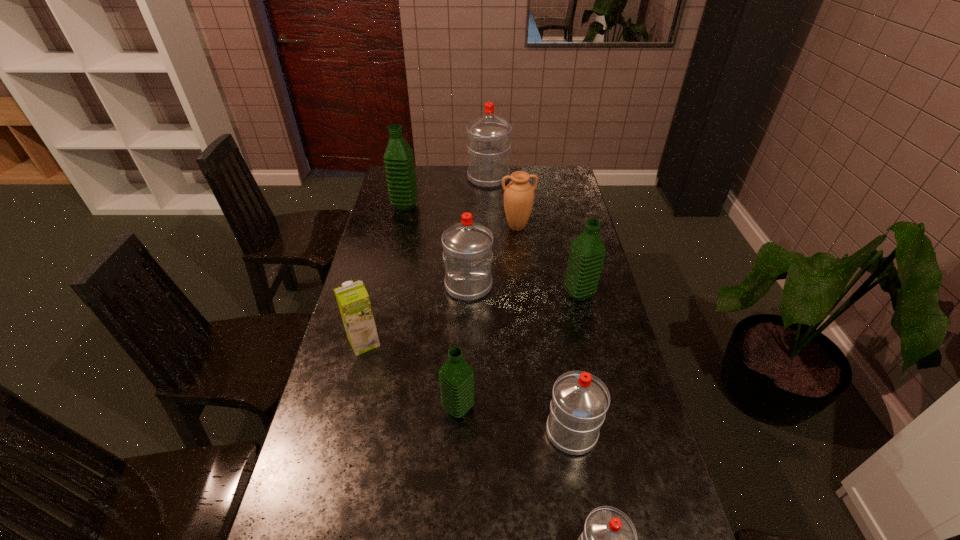
You are a GUI agent. You are given a task and a screenshot of the screen. Output one action in this format:
    pyautogui.click(x=<x>, y=<y>)
    Task: Click on the vacant space that's between the third biggest white water bottle and the second farthest water bottle
    
    Given the screenshot: What is the action you would take?
    pyautogui.click(x=489, y=319)

At what (x,y) coordinates should I click in order to perform the action: click on free space between the urn and the second nearest white water bottle. Please return your answer as a coordinate pair (x, y). Looking at the image, I should click on [x=544, y=329].

Identify which object is located as the seventh nearest to the urn. Please provide its 2D coordinates. Your answer should be formatted as a tuple, i.e. [(x, y)], where the tuple contains the x and y coordinates of a point satisfying the conditions above.

[(580, 400)]

Point out which object is positioned as the eighth nearest to the sixth farthest object. Please provide its 2D coordinates. Your answer should be formatted as a tuple, i.e. [(x, y)], where the tuple contains the x and y coordinates of a point satisfying the conditions above.

[(488, 136)]

Locate which water bottle ranks sixth in proximity to the urn. Please provide its 2D coordinates. Your answer should be formatted as a tuple, i.e. [(x, y)], where the tuple contains the x and y coordinates of a point satisfying the conditions above.

[(580, 400)]

Locate which water bottle ranks sixth in proximity to the biggest white water bottle. Please provide its 2D coordinates. Your answer should be formatted as a tuple, i.e. [(x, y)], where the tuple contains the x and y coordinates of a point satisfying the conditions above.

[(609, 539)]

Where is `the third closest white water bottle relative to the urn`? This screenshot has width=960, height=540. the third closest white water bottle relative to the urn is located at coordinates (580, 400).

In order to click on white water bottle that is the second closest to the shortest object in this screenshot , I will do `click(467, 246)`.

Identify the location of green water bottle that stands as the third closest to the nearest water bottle. (399, 163).

Choose which green water bottle is the nearest neighbor to the sixth farthest object. Please provide its 2D coordinates. Your answer should be formatted as a tuple, i.e. [(x, y)], where the tuple contains the x and y coordinates of a point satisfying the conditions above.

[(456, 377)]